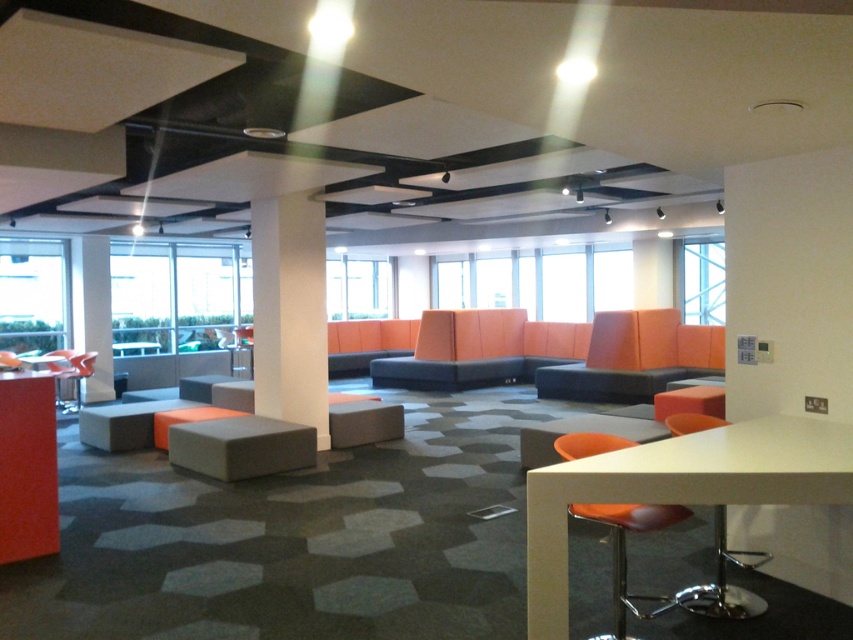
Question: Is white smooth pillar at center to the right of orange fabric chair at lower left from the viewer's perspective?

Choices:
 (A) yes
 (B) no

Answer: (A)

Question: Which point is closer to the camera?

Choices:
 (A) (x=635, y=390)
 (B) (x=86, y=289)
 (C) (x=312, y=237)

Answer: (C)

Question: Considering the relative positions of orange fabric couch at center and white glossy pillar at center in the image provided, where is orange fabric couch at center located with respect to white glossy pillar at center?

Choices:
 (A) above
 (B) below

Answer: (B)

Question: Which point is farther to the camera?

Choices:
 (A) orange fabric chair at lower left
 (B) matte gray bar stool at center
 (C) white smooth pillar at center
 (D) orange fabric couch at center

Answer: (A)

Question: Which of these objects is positioned closest to the white glossy pillar at center?

Choices:
 (A) white glossy table at lower right
 (B) matte gray bar stool at center
 (C) white smooth pillar at center

Answer: (C)

Question: Does white glossy table at lower right appear under orange fabric chair at lower left?

Choices:
 (A) yes
 (B) no

Answer: (B)